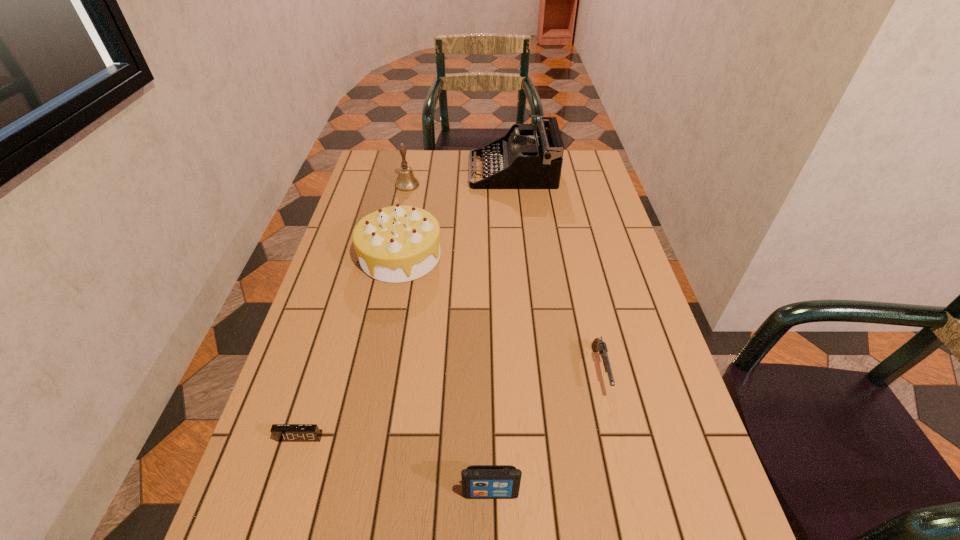
The image size is (960, 540). In order to click on alarm clock at the left edge in this screenshot , I will do `click(282, 432)`.

I want to click on typewriter that is at the right edge, so click(x=524, y=158).

Where is `gun present at the right edge`? gun present at the right edge is located at coordinates (598, 344).

Identify the location of object that is at the far left corner. The image size is (960, 540). (406, 181).

Where is `object located at the far right corner`? Image resolution: width=960 pixels, height=540 pixels. object located at the far right corner is located at coordinates (524, 158).

This screenshot has width=960, height=540. In the image, there is a desktop. In order to click on free space at the far edge in this screenshot , I will do `click(441, 152)`.

Find the location of a particular element. The image size is (960, 540). vacant region at the left edge of the desktop is located at coordinates (321, 492).

Identify the location of free space at the right edge. (660, 364).

In the image, there is a desktop. Identify the location of vacant space at the far left corner. point(368,156).

I want to click on free point between the third shortest object and the bell, so click(449, 339).